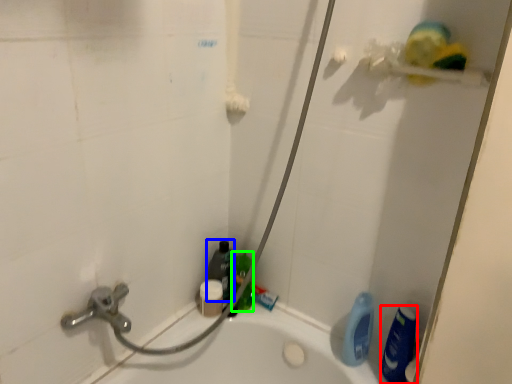
Question: Based on their relative distances, which object is farther from cleaning product (highlighted by a red box)? Choose from cleaning product (highlighted by a blue box) and cleaning product (highlighted by a green box).

Choices:
 (A) cleaning product
 (B) cleaning product

Answer: (A)